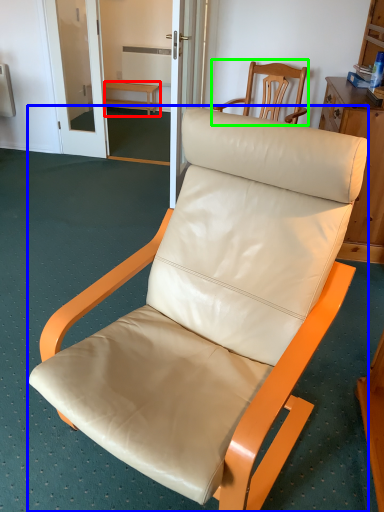
Question: Estimate the real-world distances between objects in this image. Which object is closer to furniture (highlighted by a red box), chair (highlighted by a blue box) or chair (highlighted by a green box)?

Choices:
 (A) chair
 (B) chair

Answer: (B)